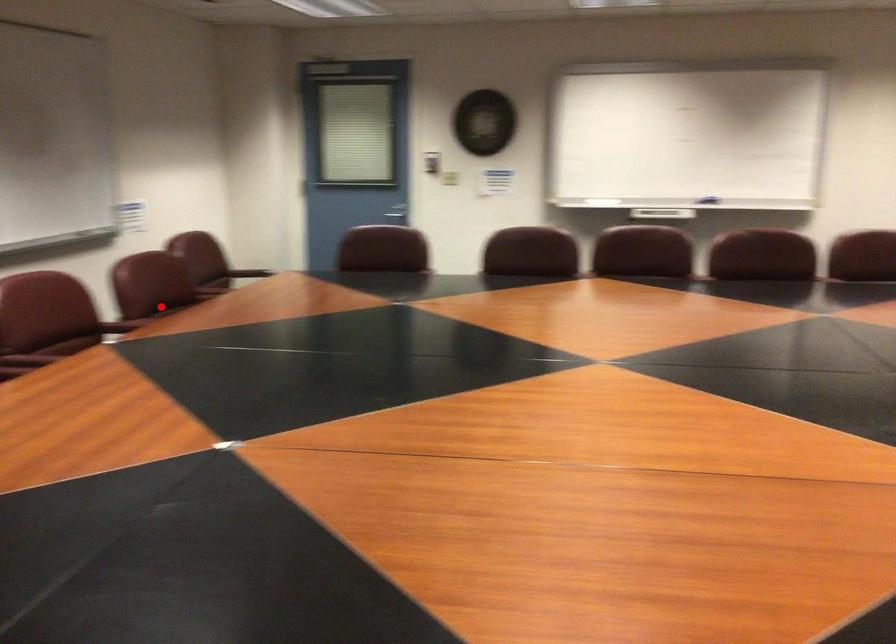
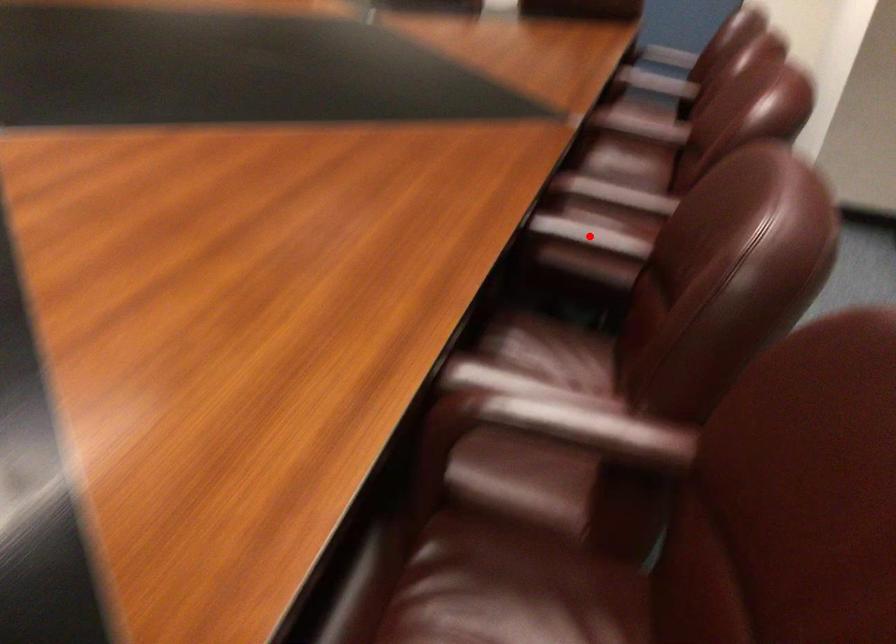
I am providing you with two images of the same scene from different viewpoints. A red point is marked on the first image and another point is marked on the second image. Is the marked point in image1 the same physical position as the marked point in image2?

Yes